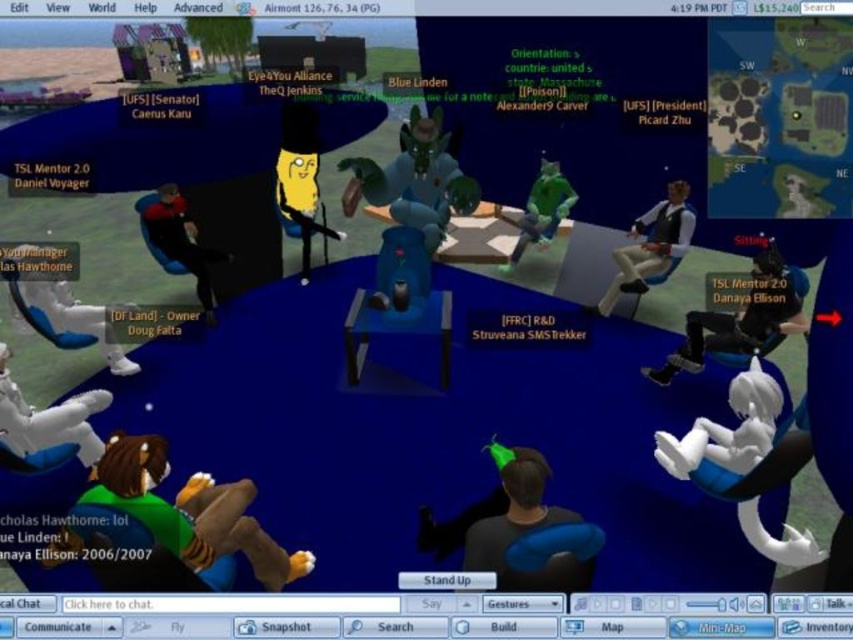
You are an avatar in the virtual meeting. You need to decide whether to stand up to speak. Considering the white fabric shirt at right and the green rubber alien at center, which avatar is shorter and might need to adjust their seat height?

The white fabric shirt at right is shorter than the green rubber alien at center, so it might need to adjust their seat height.